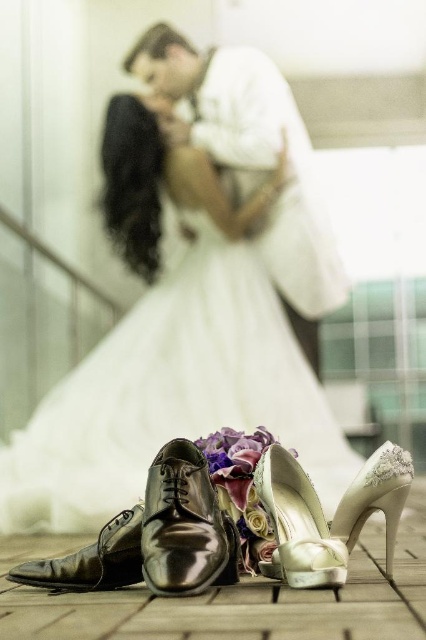
Between shiny black shoe at center and ivory satin high-heeled shoe at lower center, which one has less height?

ivory satin high-heeled shoe at lower center is shorter.

Does shiny black shoe at center have a lesser height compared to ivory satin high-heeled shoe at lower center?

No.

You are a GUI agent. You are given a task and a screenshot of the screen. Output one action in this format:
    pyautogui.click(x=<x>, y=<y>)
    Task: Click on the shiny black shoe at center
    This screenshot has height=640, width=426.
    Given the screenshot: What is the action you would take?
    point(184,525)

Find the location of a particular element. shiny black shoe at center is located at coordinates click(x=184, y=525).

The width and height of the screenshot is (426, 640). Describe the element at coordinates (296, 524) in the screenshot. I see `ivory satin high heel at center` at that location.

Which of these two, ivory satin high heel at center or ivory satin high-heeled shoe at lower center, stands taller?

Standing taller between the two is ivory satin high-heeled shoe at lower center.

Identify the location of ivory satin high heel at center. This screenshot has height=640, width=426. (296, 524).

Who is taller, white satin dress at lower center or shiny black shoe at center?

white satin dress at lower center is taller.

Does white satin dress at lower center have a lesser width compared to shiny black shoe at center?

No.

Where is `white satin dress at lower center`? The image size is (426, 640). white satin dress at lower center is located at coordinates tap(187, 378).

Locate an element on the screen. white satin dress at lower center is located at coordinates (187, 378).